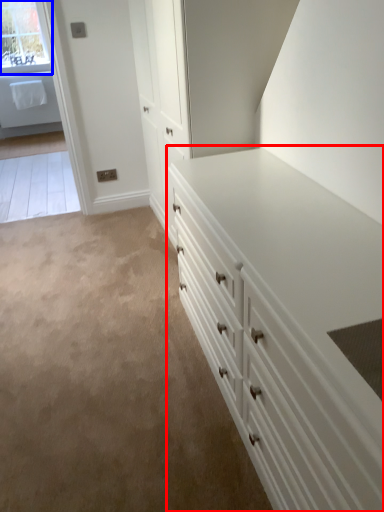
Question: Which point is further to the camera, chest of drawers (highlighted by a red box) or window (highlighted by a blue box)?

Choices:
 (A) chest of drawers
 (B) window

Answer: (B)